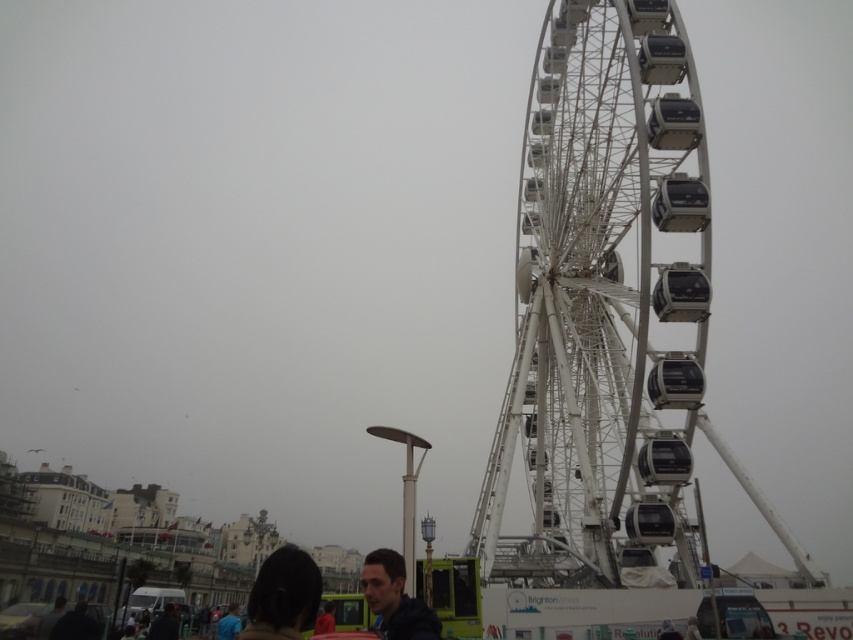
Find the location of a particular element. This screenshot has height=640, width=853. dark brown hair at lower center is located at coordinates (283, 595).

Is point (254, 614) farther from viewer compared to point (321, 627)?

No, it is not.

Which is behind, point (280, 554) or point (329, 609)?

The point (329, 609) is behind.

Identify the location of dark brown hair at lower center. This screenshot has width=853, height=640. (283, 595).

Who is positioned more to the right, dark brown hair at lower center or dark hair at lower center?

dark brown hair at lower center is more to the right.

Can you confirm if dark brown hair at lower center is shorter than dark hair at lower center?

No.

The height and width of the screenshot is (640, 853). What do you see at coordinates (283, 595) in the screenshot? I see `dark brown hair at lower center` at bounding box center [283, 595].

The image size is (853, 640). In order to click on dark brown hair at lower center in this screenshot , I will do `click(283, 595)`.

Does matte blue jacket at lower center have a greater width compared to dark hair at lower center?

Incorrect, matte blue jacket at lower center's width does not surpass dark hair at lower center's.

Is matte blue jacket at lower center positioned in front of dark hair at lower center?

Yes, matte blue jacket at lower center is closer to the viewer.

Measure the distance between matte blue jacket at lower center and camera.

matte blue jacket at lower center and camera are 57.36 meters apart.

Identify the location of matte blue jacket at lower center. (395, 598).